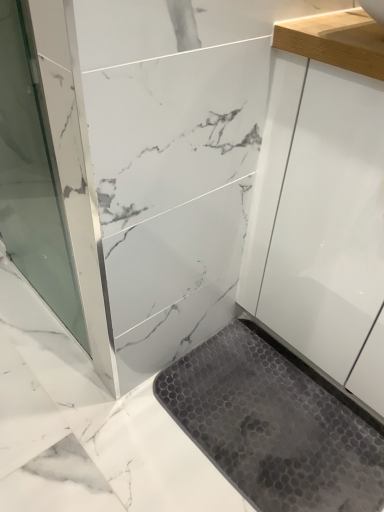
Where is `gray hexagonal rubber mat at lower center`? gray hexagonal rubber mat at lower center is located at coordinates (275, 424).

Describe the element at coordinates (275, 424) in the screenshot. I see `gray hexagonal rubber mat at lower center` at that location.

The image size is (384, 512). What do you see at coordinates (32, 180) in the screenshot?
I see `transparent glass screen door at left` at bounding box center [32, 180].

Locate an element on the screen. transparent glass screen door at left is located at coordinates (32, 180).

Where is `gray hexagonal rubber mat at lower center`? gray hexagonal rubber mat at lower center is located at coordinates (275, 424).

Considering the relative positions of gray hexagonal rubber mat at lower center and transparent glass screen door at left in the image provided, is gray hexagonal rubber mat at lower center to the left of transparent glass screen door at left from the viewer's perspective?

Incorrect, gray hexagonal rubber mat at lower center is not on the left side of transparent glass screen door at left.

Which object is further away from the camera, gray hexagonal rubber mat at lower center or transparent glass screen door at left?

gray hexagonal rubber mat at lower center.

Does point (243, 333) come behind point (36, 192)?

That is False.

From the image's perspective, is gray hexagonal rubber mat at lower center located above or below transparent glass screen door at left?

From the image's perspective, gray hexagonal rubber mat at lower center appears below transparent glass screen door at left.

From a real-world perspective, is gray hexagonal rubber mat at lower center positioned above or below transparent glass screen door at left?

In terms of real-world spatial position, gray hexagonal rubber mat at lower center is below transparent glass screen door at left.

Looking at their sizes, would you say gray hexagonal rubber mat at lower center is wider or thinner than transparent glass screen door at left?

gray hexagonal rubber mat at lower center is wider than transparent glass screen door at left.

Can you confirm if gray hexagonal rubber mat at lower center is taller than transparent glass screen door at left?

No, gray hexagonal rubber mat at lower center is not taller than transparent glass screen door at left.

In the scene shown: Considering the sizes of objects gray hexagonal rubber mat at lower center and transparent glass screen door at left in the image provided, who is bigger, gray hexagonal rubber mat at lower center or transparent glass screen door at left?

With larger size is transparent glass screen door at left.

Would you say gray hexagonal rubber mat at lower center contains transparent glass screen door at left?

No, transparent glass screen door at left is not surrounded by gray hexagonal rubber mat at lower center.

Is gray hexagonal rubber mat at lower center with transparent glass screen door at left?

No, gray hexagonal rubber mat at lower center is not beside transparent glass screen door at left.

Is gray hexagonal rubber mat at lower center oriented away from transparent glass screen door at left?

That's not correct — gray hexagonal rubber mat at lower center is not looking away from transparent glass screen door at left.

How distant is gray hexagonal rubber mat at lower center from transparent glass screen door at left?

gray hexagonal rubber mat at lower center and transparent glass screen door at left are 27.39 inches apart from each other.

You are a GUI agent. You are given a task and a screenshot of the screen. Output one action in this format:
    pyautogui.click(x=<x>, y=<y>)
    Task: Click on the screen door above the gray hexagonal rubber mat at lower center (from a real-world perspective)
    
    Given the screenshot: What is the action you would take?
    pyautogui.click(x=32, y=180)

Can you confirm if transparent glass screen door at left is positioned to the left of gray hexagonal rubber mat at lower center?

Indeed, transparent glass screen door at left is positioned on the left side of gray hexagonal rubber mat at lower center.

Is transparent glass screen door at left closer to camera compared to gray hexagonal rubber mat at lower center?

That is True.

Considering the points (67, 295) and (229, 457), which point is in front, point (67, 295) or point (229, 457)?

The point (229, 457) is closer to the camera.

From the image's perspective, which one is positioned higher, transparent glass screen door at left or gray hexagonal rubber mat at lower center?

transparent glass screen door at left is shown above in the image.

From a real-world perspective, is transparent glass screen door at left located higher than gray hexagonal rubber mat at lower center?

Correct, in the physical world, transparent glass screen door at left is higher than gray hexagonal rubber mat at lower center.

Between transparent glass screen door at left and gray hexagonal rubber mat at lower center, which one has larger width?

With larger width is gray hexagonal rubber mat at lower center.

Who is taller, transparent glass screen door at left or gray hexagonal rubber mat at lower center?

transparent glass screen door at left.

Considering the relative sizes of transparent glass screen door at left and gray hexagonal rubber mat at lower center in the image provided, is transparent glass screen door at left smaller than gray hexagonal rubber mat at lower center?

Actually, transparent glass screen door at left might be larger than gray hexagonal rubber mat at lower center.

Consider the image. Could gray hexagonal rubber mat at lower center be considered to be inside transparent glass screen door at left?

No.

Based on the photo, is transparent glass screen door at left directly adjacent to gray hexagonal rubber mat at lower center?

transparent glass screen door at left and gray hexagonal rubber mat at lower center are not in contact.

Is transparent glass screen door at left turned away from gray hexagonal rubber mat at lower center?

transparent glass screen door at left is not turned away from gray hexagonal rubber mat at lower center.

How many degrees apart are the facing directions of transparent glass screen door at left and gray hexagonal rubber mat at lower center?

2.44 degrees separate the facing orientations of transparent glass screen door at left and gray hexagonal rubber mat at lower center.

How much distance is there between transparent glass screen door at left and gray hexagonal rubber mat at lower center?

27.39 inches.

Identify the location of screen door on the left of gray hexagonal rubber mat at lower center. (32, 180).

Locate an element on the screen. bath mat lying on the right of transparent glass screen door at left is located at coordinates (275, 424).

This screenshot has height=512, width=384. In order to click on bath mat below the transparent glass screen door at left (from the image's perspective) in this screenshot , I will do `click(275, 424)`.